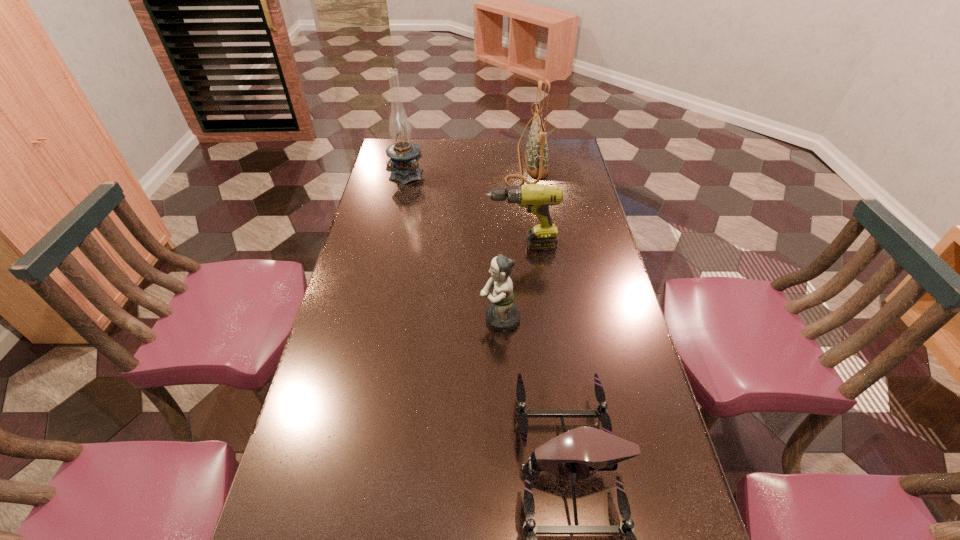
The height and width of the screenshot is (540, 960). What are the coordinates of `free space located 0.280m on the handle side of the third nearest object` in the screenshot? It's located at (402, 246).

Where is `vacant area situated on the handle side of the third nearest object`? vacant area situated on the handle side of the third nearest object is located at coordinates (378, 246).

Find the location of a particular element. The image size is (960, 540). vacant space located on the front-facing side of the figurine is located at coordinates (385, 319).

At what (x,y) coordinates should I click in order to perform the action: click on blank space located 0.280m on the front-facing side of the figurine. Please return your answer as a coordinate pair (x, y). Image resolution: width=960 pixels, height=540 pixels. Looking at the image, I should click on (381, 319).

You are a GUI agent. You are given a task and a screenshot of the screen. Output one action in this format:
    pyautogui.click(x=<x>, y=<y>)
    Task: Click on the vacant space situated 0.080m on the front-facing side of the figurine
    The width and height of the screenshot is (960, 540).
    Given the screenshot: What is the action you would take?
    pyautogui.click(x=452, y=319)

Locate an element on the screen. The height and width of the screenshot is (540, 960). oil lamp that is at the far edge is located at coordinates (404, 154).

Find the location of a particular element. The width and height of the screenshot is (960, 540). handbag situated at the far edge is located at coordinates (536, 154).

Locate an element on the screen. object that is at the left edge is located at coordinates (404, 154).

Where is `handbag located in the right edge section of the desktop`? This screenshot has height=540, width=960. handbag located in the right edge section of the desktop is located at coordinates (536, 154).

Where is `drill present at the right edge`? This screenshot has width=960, height=540. drill present at the right edge is located at coordinates (537, 198).